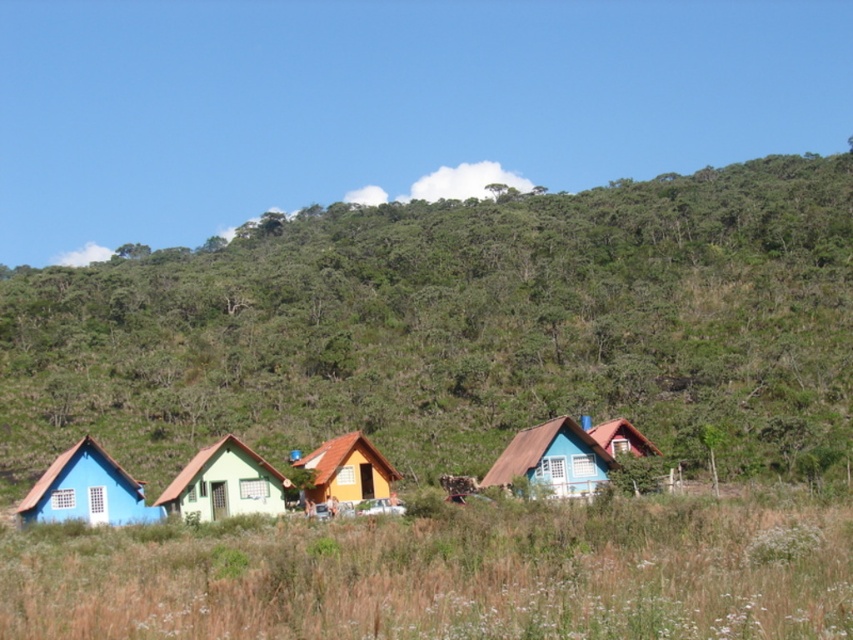
Can you confirm if green leafy hillside at center is positioned to the left of matte blue wooden house at lower left?

No, green leafy hillside at center is not to the left of matte blue wooden house at lower left.

Between point (758, 360) and point (76, 444), which one is positioned behind?

Positioned behind is point (758, 360).

The image size is (853, 640). What do you see at coordinates (454, 326) in the screenshot? I see `green leafy hillside at center` at bounding box center [454, 326].

Where is `green leafy hillside at center`? Image resolution: width=853 pixels, height=640 pixels. green leafy hillside at center is located at coordinates (454, 326).

Does green grass at lower center appear on the right side of matte blue wooden hut at center?

Incorrect, green grass at lower center is not on the right side of matte blue wooden hut at center.

Is green grass at lower center thinner than matte blue wooden hut at center?

In fact, green grass at lower center might be wider than matte blue wooden hut at center.

The width and height of the screenshot is (853, 640). Identify the location of green grass at lower center. (447, 576).

Who is shorter, green grass at lower center or green matte house at center?

With less height is green matte house at center.

Is green grass at lower center thinner than green matte house at center?

No.

This screenshot has width=853, height=640. In order to click on green grass at lower center in this screenshot , I will do `click(447, 576)`.